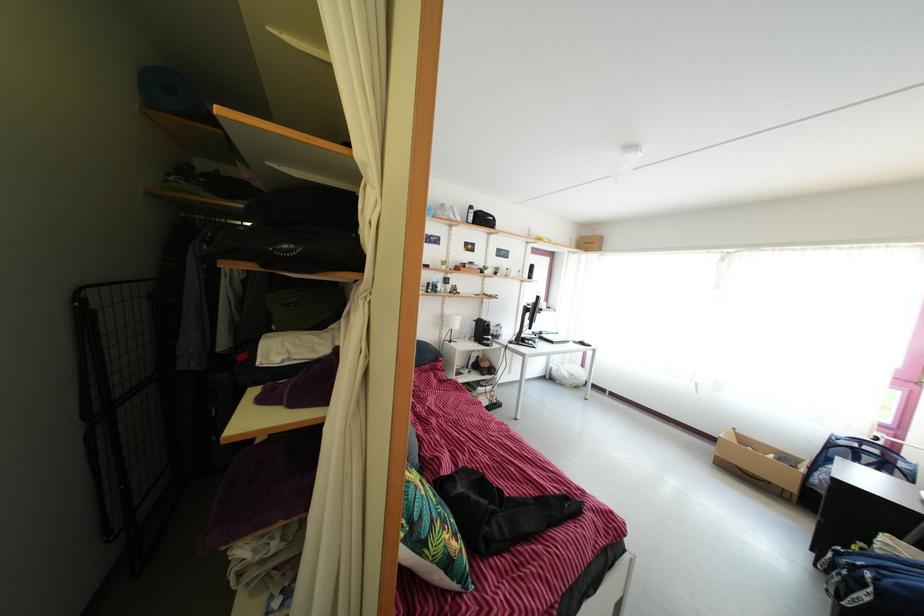
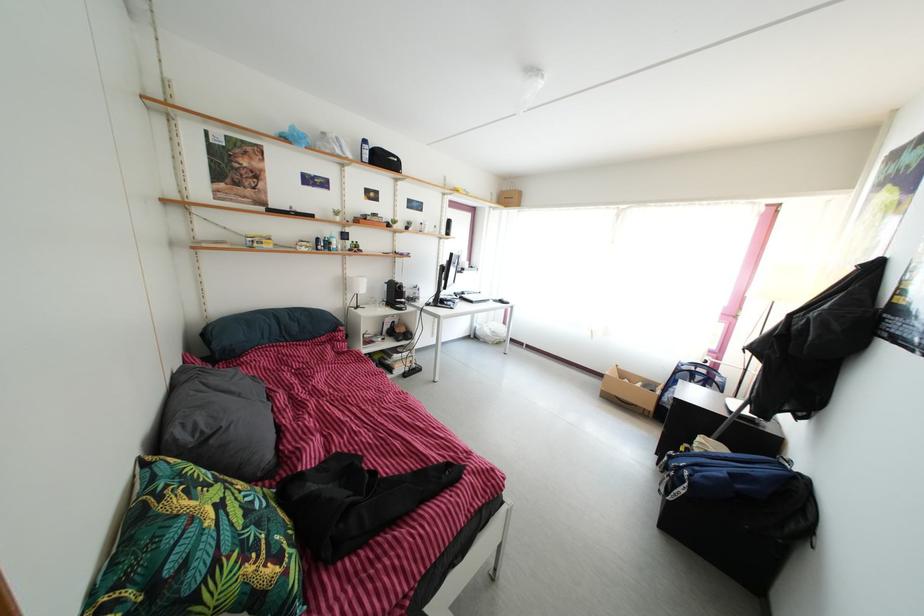
In the second image, find the point that corresponds to [489,373] in the first image.

(405, 339)